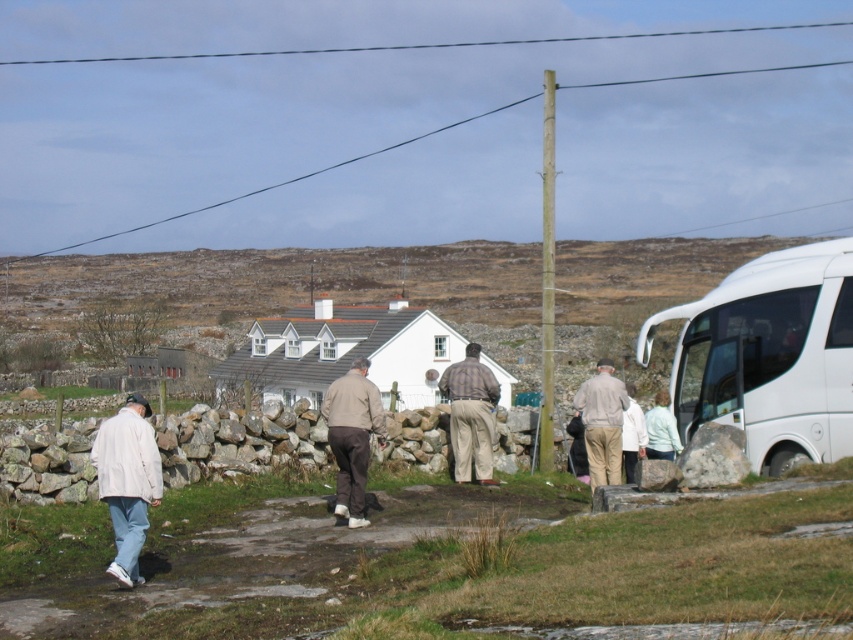
Question: Which of the following is the closest to the observer?

Choices:
 (A) white glossy van at right
 (B) light brown fabric jacket at center

Answer: (A)

Question: Which of these objects is positioned farthest from the light brown fabric jacket at center?

Choices:
 (A) white matte jacket at lower left
 (B) white glossy van at right
 (C) plaid shirt at center

Answer: (B)

Question: Which object is positioned farthest from the white matte jacket at lower left?

Choices:
 (A) light brown fabric jacket at center
 (B) light brown fabric pants at center

Answer: (B)

Question: Where is white glossy van at right located in relation to light brown fabric pants at center in the image?

Choices:
 (A) left
 (B) right

Answer: (B)

Question: Does plaid shirt at center appear on the left side of light brown fabric pants at center?

Choices:
 (A) yes
 (B) no

Answer: (A)

Question: Is white glossy van at right to the right of light brown fabric jacket at center from the viewer's perspective?

Choices:
 (A) yes
 (B) no

Answer: (A)